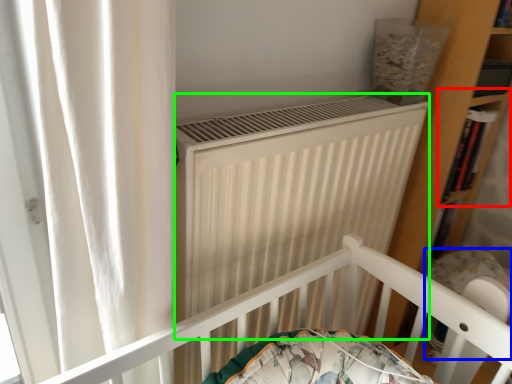
Question: Based on their relative distances, which object is farther from shelf (highlighted by a red box)? Choose from baby carriage (highlighted by a blue box) and heater (highlighted by a green box).

Choices:
 (A) baby carriage
 (B) heater

Answer: (B)